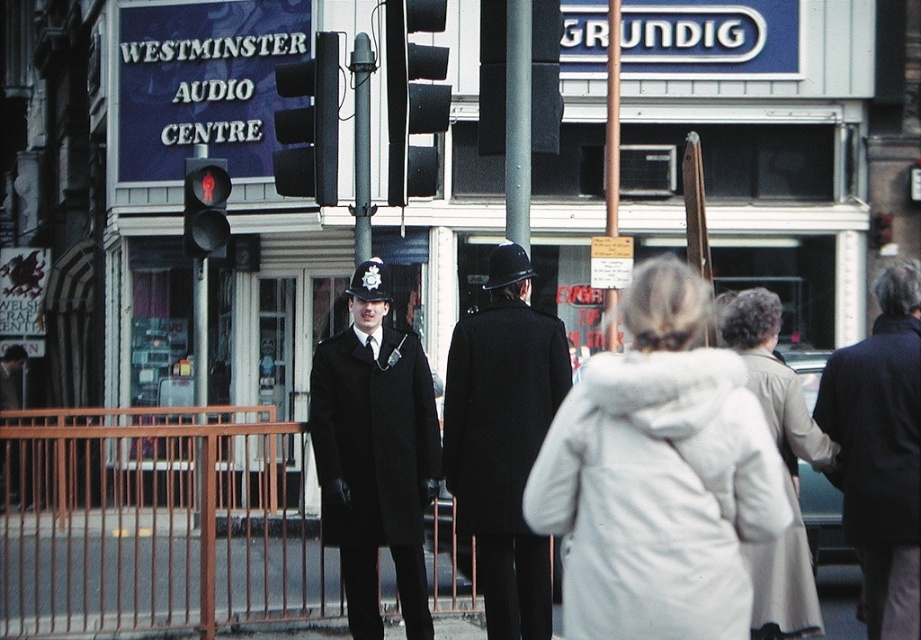
Question: Is black plastic traffic light at upper center in front of red glass traffic light at center?

Choices:
 (A) no
 (B) yes

Answer: (B)

Question: Which is farther from the light beige fabric coat at lower right?

Choices:
 (A) white fuzzy coat at center
 (B) black plastic traffic light at upper center

Answer: (B)

Question: Is white fuzzy coat at center closer to the viewer compared to navy blue fabric coat at right?

Choices:
 (A) yes
 (B) no

Answer: (A)

Question: Among these points, which one is farthest from the camera?

Choices:
 (A) (205, 504)
 (B) (389, 284)

Answer: (A)

Question: Does navy blue fabric coat at right have a smaller size compared to light beige fabric coat at lower right?

Choices:
 (A) no
 (B) yes

Answer: (B)

Question: Which object is farther from the camera taking this photo?

Choices:
 (A) white fuzzy coat at center
 (B) matte black coat at center

Answer: (B)